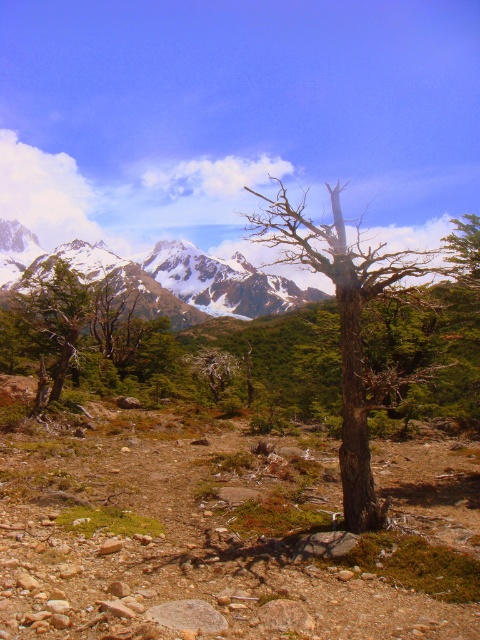
Who is taller, white snow-covered mountain range at upper left or green matte tree at left?

Standing taller between the two is white snow-covered mountain range at upper left.

Based on the photo, can you confirm if white snow-covered mountain range at upper left is wider than green matte tree at left?

Correct, the width of white snow-covered mountain range at upper left exceeds that of green matte tree at left.

Which is behind, point (190, 298) or point (71, 353)?

The point (190, 298) is behind.

The height and width of the screenshot is (640, 480). Identify the location of white snow-covered mountain range at upper left. (157, 276).

Between brown rough tree at center and green matte tree at left, which one is positioned lower?

green matte tree at left is below.

Locate an element on the screen. brown rough tree at center is located at coordinates click(x=343, y=323).

Can you confirm if brown rough tree at center is positioned to the right of white snow-covered mountain range at upper left?

Indeed, brown rough tree at center is positioned on the right side of white snow-covered mountain range at upper left.

Between brown rough tree at center and white snow-covered mountain range at upper left, which one is positioned higher?

Positioned higher is brown rough tree at center.

The height and width of the screenshot is (640, 480). What do you see at coordinates (343, 323) in the screenshot?
I see `brown rough tree at center` at bounding box center [343, 323].

This screenshot has width=480, height=640. Find the location of `brown rough tree at center`. brown rough tree at center is located at coordinates (343, 323).